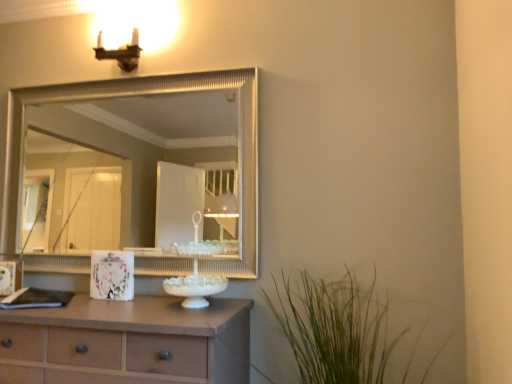
Question: Considering the positions of matte brown sconce at upper left and silver textured mirror at upper center in the image, is matte brown sconce at upper left taller or shorter than silver textured mirror at upper center?

Choices:
 (A) short
 (B) tall

Answer: (A)

Question: In the image, is matte brown sconce at upper left on the left side or the right side of silver textured mirror at upper center?

Choices:
 (A) left
 (B) right

Answer: (B)

Question: Which object is the farthest from the matte brown chest of drawers at lower left?

Choices:
 (A) green grass at lower right
 (B) white glossy picture frame at center
 (C) matte brown sconce at upper left
 (D) silver textured mirror at upper center

Answer: (D)

Question: Which is nearer to the matte brown sconce at upper left?

Choices:
 (A) matte brown chest of drawers at lower left
 (B) silver textured mirror at upper center
 (C) green grass at lower right
 (D) white glossy picture frame at center

Answer: (D)